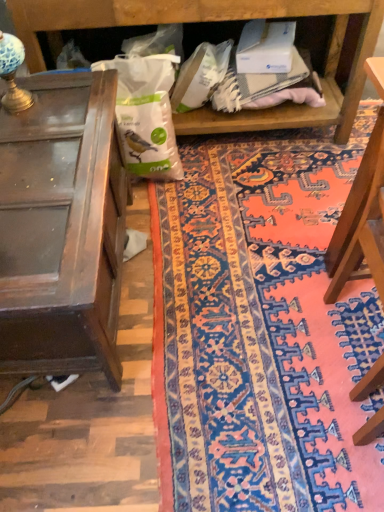
Where is `free space in front of blue glass lamp at upper left`? This screenshot has height=512, width=384. free space in front of blue glass lamp at upper left is located at coordinates (26, 125).